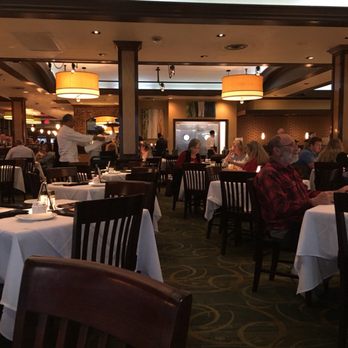
What are the coordinates of `chair` in the screenshot? It's located at (134, 302), (105, 211), (9, 176), (122, 186), (141, 176), (153, 161), (194, 167), (230, 176), (256, 201), (338, 198).